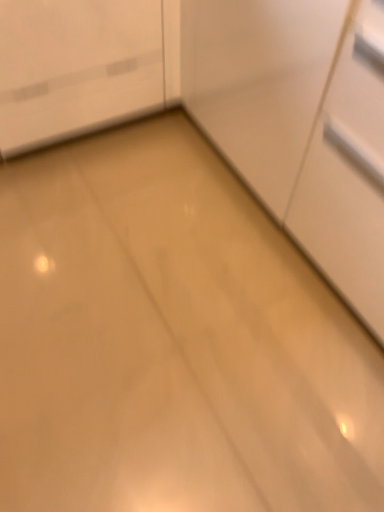
At what (x,y) coordinates should I click in order to perform the action: click on white glossy refrigerator at upper left. Please return your answer as a coordinate pair (x, y). The height and width of the screenshot is (512, 384). Looking at the image, I should click on (76, 67).

The image size is (384, 512). What do you see at coordinates (76, 67) in the screenshot?
I see `white glossy refrigerator at upper left` at bounding box center [76, 67].

You are a GUI agent. You are given a task and a screenshot of the screen. Output one action in this format:
    pyautogui.click(x=<x>, y=<y>)
    Task: Click on the white glossy refrigerator at upper left
    
    Given the screenshot: What is the action you would take?
    pyautogui.click(x=76, y=67)